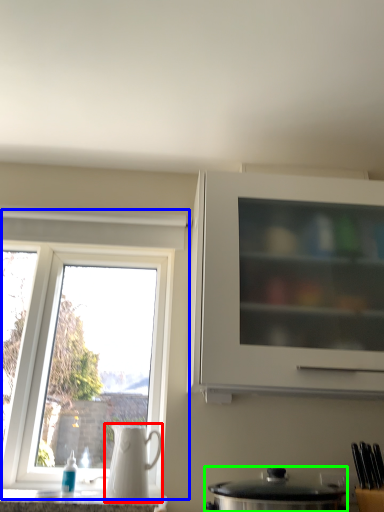
Question: Based on their relative distances, which object is farther from jug (highlighted by a red box)? Choose from window (highlighted by a blue box) and kitchen appliance (highlighted by a green box).

Choices:
 (A) window
 (B) kitchen appliance

Answer: (A)